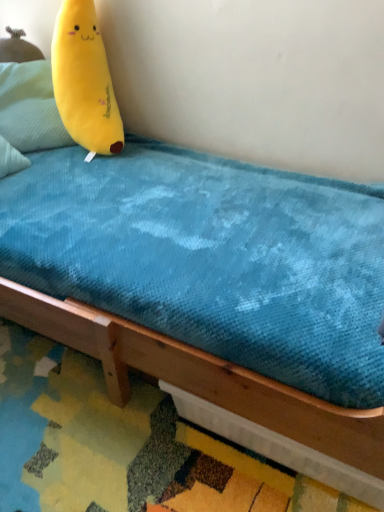
Question: From their relative heights in the image, would you say yellow plush at upper left is taller or shorter than yellow plush at upper left?

Choices:
 (A) short
 (B) tall

Answer: (B)

Question: In terms of width, does yellow plush at upper left look wider or thinner when compared to yellow plush at upper left?

Choices:
 (A) thin
 (B) wide

Answer: (B)

Question: Which is correct: yellow plush at upper left is inside yellow plush at upper left, or outside of it?

Choices:
 (A) inside
 (B) outside

Answer: (B)

Question: Considering the positions of yellow plush at upper left and yellow plush at upper left in the image, is yellow plush at upper left bigger or smaller than yellow plush at upper left?

Choices:
 (A) big
 (B) small

Answer: (B)

Question: Based on their positions, is yellow plush at upper left located to the left or right of yellow plush at upper left?

Choices:
 (A) right
 (B) left

Answer: (B)

Question: From their relative heights in the image, would you say yellow plush at upper left is taller or shorter than yellow plush at upper left?

Choices:
 (A) short
 (B) tall

Answer: (A)

Question: From the image's perspective, is yellow plush at upper left above or below yellow plush at upper left?

Choices:
 (A) above
 (B) below

Answer: (A)